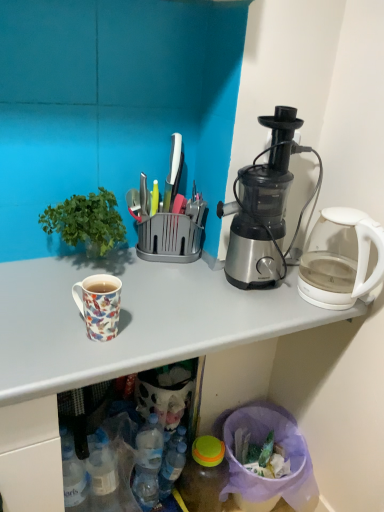
Find the location of a particular element. This screenshot has height=512, width=384. free space between floral ceramic mug at left and transparent glass kettle at right is located at coordinates (218, 318).